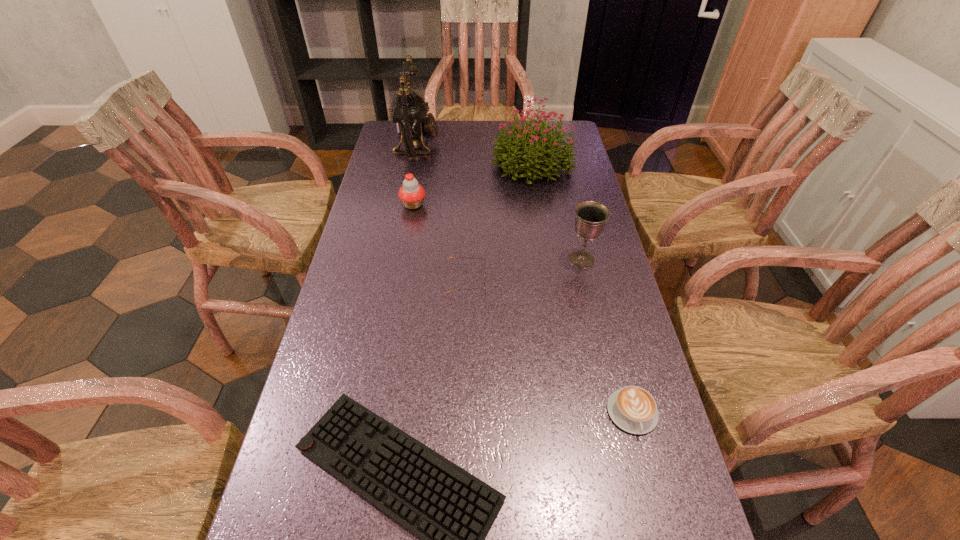
Where is `vacant space located 0.050m on the back of the fourth shortest object`? vacant space located 0.050m on the back of the fourth shortest object is located at coordinates (416, 188).

Find the location of `vacant space situated 0.340m on the temples of the fifth tallest object`. vacant space situated 0.340m on the temples of the fifth tallest object is located at coordinates (616, 280).

The height and width of the screenshot is (540, 960). Find the location of `vacant space situated 0.100m on the side of the second shortest object with the handle`. vacant space situated 0.100m on the side of the second shortest object with the handle is located at coordinates (653, 492).

The image size is (960, 540). Identify the location of telephone present at the far edge. (411, 116).

Image resolution: width=960 pixels, height=540 pixels. I want to click on bouquet that is at the far edge, so click(x=519, y=140).

I want to click on telephone at the left edge, so click(x=411, y=116).

The width and height of the screenshot is (960, 540). In order to click on cupcake located in the left edge section of the desktop in this screenshot , I will do `click(411, 194)`.

Identify the location of bouquet that is at the right edge. This screenshot has width=960, height=540. (519, 140).

Locate an element on the screen. chalice that is at the right edge is located at coordinates (591, 216).

At what (x,y) coordinates should I click in order to perform the action: click on cappuccino situated at the right edge. Please return your answer as a coordinate pair (x, y). Image resolution: width=960 pixels, height=540 pixels. Looking at the image, I should click on (632, 408).